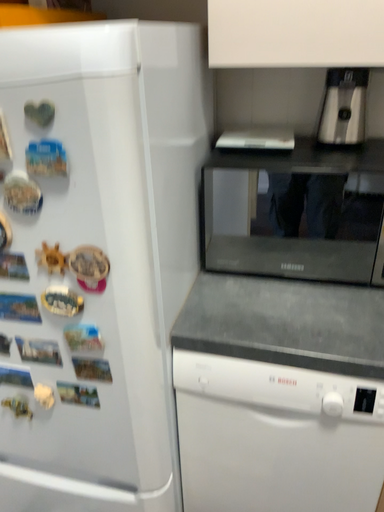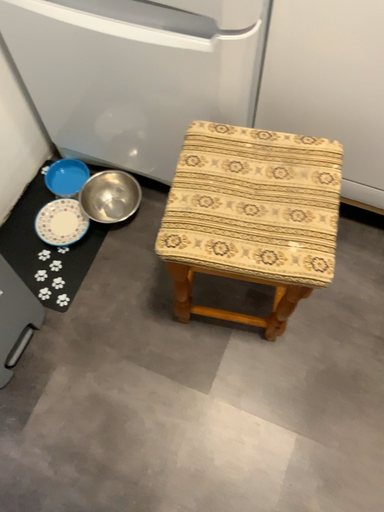
Question: How did the camera likely rotate when shooting the video?

Choices:
 (A) rotated right
 (B) rotated left

Answer: (B)